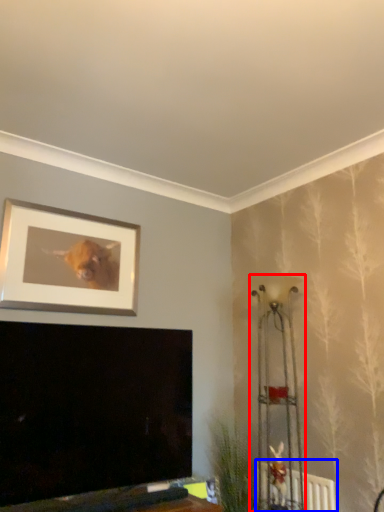
Question: Which object appears farthest to the camera in this image, lamp (highlighted by a red box) or radiator (highlighted by a blue box)?

Choices:
 (A) lamp
 (B) radiator

Answer: (B)